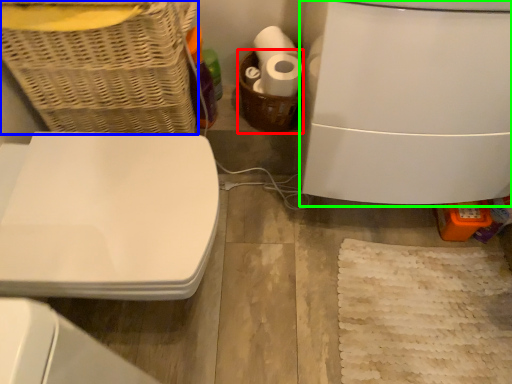
Question: Which object is positioned closest to basket (highlighted by a red box)? Select from basket (highlighted by a blue box) and appliance (highlighted by a green box).

Choices:
 (A) basket
 (B) appliance

Answer: (B)